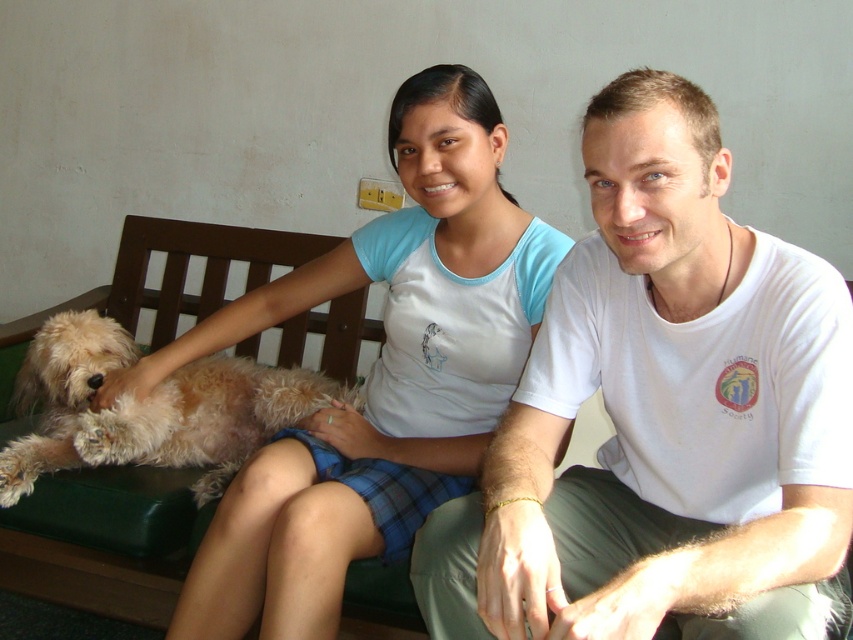
Does white cotton t-shirt at center have a greater height compared to fuzzy brown dog at lower left?

Yes.

Can you confirm if white cotton t-shirt at center is wider than fuzzy brown dog at lower left?

In fact, white cotton t-shirt at center might be narrower than fuzzy brown dog at lower left.

Locate an element on the screen. white cotton t-shirt at center is located at coordinates (663, 417).

The width and height of the screenshot is (853, 640). Identify the location of white cotton t-shirt at center. (663, 417).

Does white cotton t-shirt at center have a smaller size compared to light blue fabric shirt at center?

Yes, white cotton t-shirt at center is smaller than light blue fabric shirt at center.

Does point (720, 572) come closer to viewer compared to point (440, 284)?

That is True.

Image resolution: width=853 pixels, height=640 pixels. Identify the location of white cotton t-shirt at center. tap(663, 417).

Does light blue fabric shirt at center have a greater width compared to fuzzy brown dog at lower left?

Yes.

Which is behind, point (422, 481) or point (59, 424)?

The point (59, 424) is more distant.

Image resolution: width=853 pixels, height=640 pixels. I want to click on light blue fabric shirt at center, so click(376, 376).